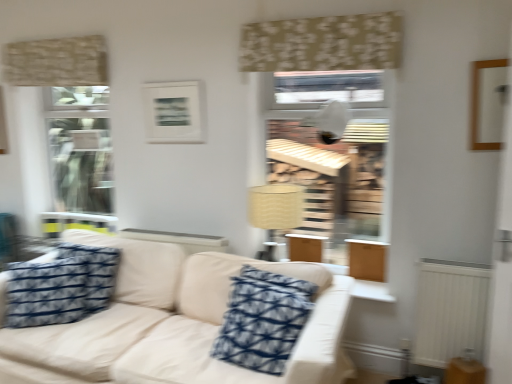
Identify the location of empty space that is ontop of beige floral fabric at upper center, which is the 2th curtain in back-to-front order. (311, 16).